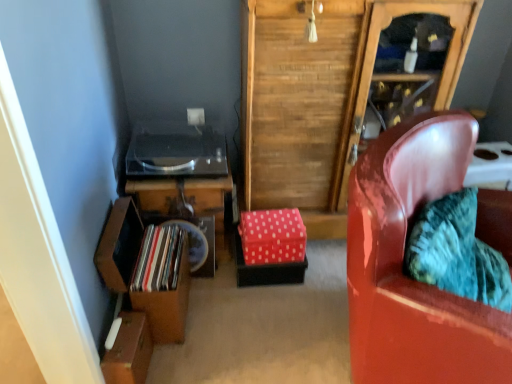
Question: Does red polka dot fabric box at center, the second box viewed from the front, touch shiny metallic record at left?

Choices:
 (A) yes
 (B) no

Answer: (B)

Question: Does red polka dot fabric box at center, which is the first box in right-to-left order, have a smaller size compared to shiny metallic record at left?

Choices:
 (A) no
 (B) yes

Answer: (A)

Question: Is red polka dot fabric box at center, marked as the first box in a back-to-front arrangement, facing away from shiny metallic record at left?

Choices:
 (A) no
 (B) yes

Answer: (A)

Question: Is red polka dot fabric box at center, which is the first box in right-to-left order, bigger than shiny metallic record at left?

Choices:
 (A) no
 (B) yes

Answer: (B)

Question: Does red polka dot fabric box at center, the second box in the left-to-right sequence, appear on the left side of shiny metallic record at left?

Choices:
 (A) yes
 (B) no

Answer: (B)

Question: Is wooden shelf at lower left inside or outside of wooden record player at lower left?

Choices:
 (A) inside
 (B) outside

Answer: (B)

Question: Looking at the image, does wooden shelf at lower left seem bigger or smaller compared to wooden record player at lower left?

Choices:
 (A) big
 (B) small

Answer: (A)

Question: Would you say wooden shelf at lower left is to the left or to the right of wooden record player at lower left in the picture?

Choices:
 (A) right
 (B) left

Answer: (B)

Question: From the image's perspective, relative to wooden record player at lower left, is wooden shelf at lower left above or below?

Choices:
 (A) above
 (B) below

Answer: (B)

Question: Does point (131, 340) appear closer or farther from the camera than point (148, 289)?

Choices:
 (A) closer
 (B) farther

Answer: (A)

Question: Relative to shiny metallic record at left, is brown cardboard box at lower left, marked as the first box in a bottom-to-top arrangement, in front or behind?

Choices:
 (A) behind
 (B) front

Answer: (B)

Question: In terms of height, does brown cardboard box at lower left, marked as the 1th box in a left-to-right arrangement, look taller or shorter compared to shiny metallic record at left?

Choices:
 (A) short
 (B) tall

Answer: (B)

Question: Looking at their shapes, would you say brown cardboard box at lower left, marked as the first box in a bottom-to-top arrangement, is wider or thinner than shiny metallic record at left?

Choices:
 (A) thin
 (B) wide

Answer: (A)

Question: From a real-world perspective, is brown cardboard box at lower left, marked as the first box in a bottom-to-top arrangement, physically located above or below glossy leather chair at right?

Choices:
 (A) below
 (B) above

Answer: (A)

Question: Considering the relative positions of brown cardboard box at lower left, marked as the 1th box in a left-to-right arrangement, and glossy leather chair at right in the image provided, is brown cardboard box at lower left, marked as the 1th box in a left-to-right arrangement, to the left or to the right of glossy leather chair at right?

Choices:
 (A) left
 (B) right

Answer: (A)